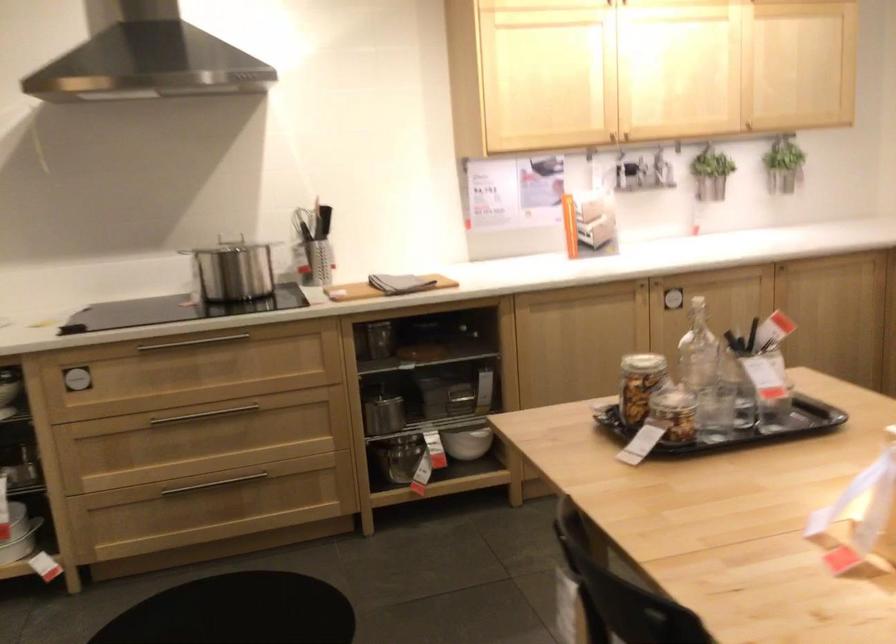
You are a GUI agent. You are given a task and a screenshot of the screen. Output one action in this format:
    pyautogui.click(x=<x>, y=<y>)
    Task: Click on the cabinet knob
    
    Given the screenshot: What is the action you would take?
    pyautogui.click(x=798, y=64)